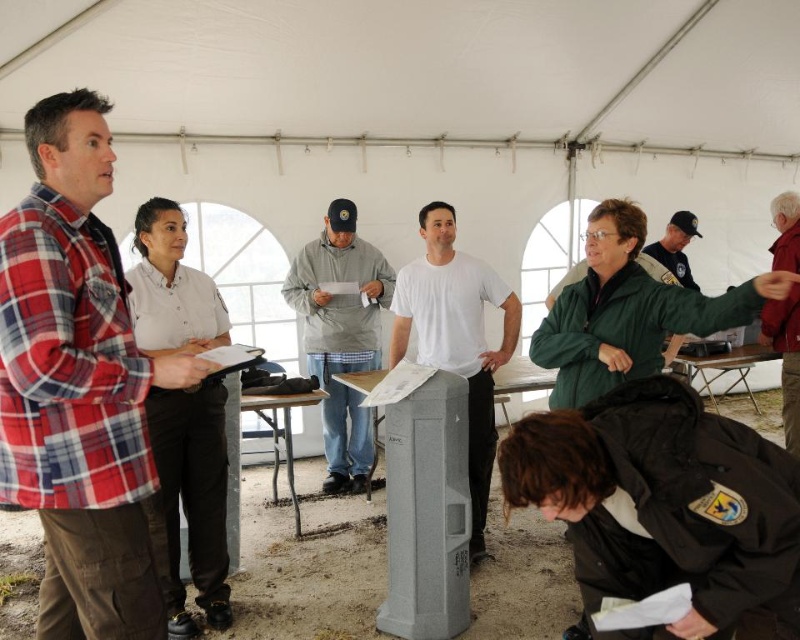
Question: Which object is closer to the camera taking this photo?

Choices:
 (A) white matte pedestal at center
 (B) metallic silver table at center
 (C) gray fabric jacket at center
 (D) plaid flannel shirt at left

Answer: (D)

Question: Does white shirt at left appear over white matte pedestal at center?

Choices:
 (A) yes
 (B) no

Answer: (B)

Question: Is white matte pedestal at center in front of gray fabric jacket at center?

Choices:
 (A) yes
 (B) no

Answer: (A)

Question: Can you confirm if plaid flannel shirt at left is positioned to the left of metallic silver table at center?

Choices:
 (A) yes
 (B) no

Answer: (A)

Question: Which of the following is the farthest from the observer?

Choices:
 (A) gray fabric jacket at center
 (B) metallic silver table at center
 (C) plaid flannel shirt at left
 (D) green matte jacket at upper right

Answer: (A)

Question: Among these points, which one is farthest from the camera?

Choices:
 (A) (68, 188)
 (B) (456, 333)
 (C) (628, 228)

Answer: (B)